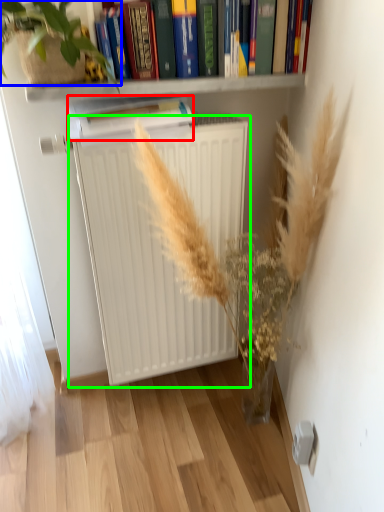
Question: Estimate the real-world distances between objects in this image. Which object is farther from paperback book (highlighted by a red box), vegetation (highlighted by a blue box) or radiator (highlighted by a green box)?

Choices:
 (A) vegetation
 (B) radiator

Answer: (B)